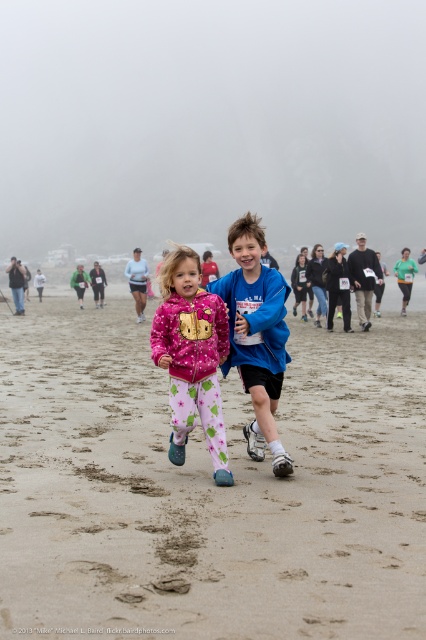
Does sandy beach at center appear on the right side of blue fleece jacket at center?

No, sandy beach at center is not to the right of blue fleece jacket at center.

Is point (322, 486) behind point (236, 292)?

No, (322, 486) is in front of (236, 292).

Is point (385, 572) positioned after point (244, 368)?

No, it is not.

Locate an element on the screen. The height and width of the screenshot is (640, 426). sandy beach at center is located at coordinates (207, 490).

Which is above, pink fleece jacket at center or blue fleece jacket at center?

blue fleece jacket at center is above.

Does pink fleece jacket at center have a larger size compared to blue fleece jacket at center?

No.

Find the location of a particular element. This screenshot has width=426, height=640. pink fleece jacket at center is located at coordinates (192, 356).

Is point (91, 556) positioned in front of point (207, 444)?

Yes, it is.

Is sandy beach at center smaller than pink fleece jacket at center?

Actually, sandy beach at center might be larger than pink fleece jacket at center.

Does point (135, 624) lie in front of point (201, 380)?

Yes, point (135, 624) is in front of point (201, 380).

This screenshot has height=640, width=426. I want to click on sandy beach at center, so click(x=207, y=490).